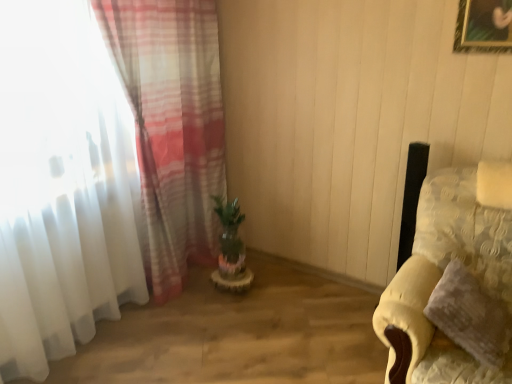
Question: Does green matte plant at center have a greater width compared to yellow fabric couch at right?

Choices:
 (A) yes
 (B) no

Answer: (B)

Question: Would you say yellow fabric couch at right is part of green matte plant at center's contents?

Choices:
 (A) no
 (B) yes

Answer: (A)

Question: From a real-world perspective, is green matte plant at center physically above yellow fabric couch at right?

Choices:
 (A) no
 (B) yes

Answer: (A)

Question: Is green matte plant at center at the right side of yellow fabric couch at right?

Choices:
 (A) yes
 (B) no

Answer: (B)

Question: Is the depth of green matte plant at center greater than that of yellow fabric couch at right?

Choices:
 (A) no
 (B) yes

Answer: (B)

Question: From a real-world perspective, is green matte plant at center above or below yellow fabric couch at right?

Choices:
 (A) above
 (B) below

Answer: (B)

Question: Considering the positions of point (234, 210) and point (495, 296), is point (234, 210) closer or farther from the camera than point (495, 296)?

Choices:
 (A) farther
 (B) closer

Answer: (A)

Question: From the image's perspective, relative to yellow fabric couch at right, is green matte plant at center above or below?

Choices:
 (A) below
 (B) above

Answer: (B)

Question: Relative to yellow fabric couch at right, is green matte plant at center in front or behind?

Choices:
 (A) behind
 (B) front

Answer: (A)

Question: Is translucent fabric curtain at left bigger or smaller than yellow fabric couch at right?

Choices:
 (A) big
 (B) small

Answer: (A)

Question: Considering the relative positions of translucent fabric curtain at left and yellow fabric couch at right in the image provided, is translucent fabric curtain at left to the left or to the right of yellow fabric couch at right?

Choices:
 (A) right
 (B) left

Answer: (B)

Question: Is point (70, 286) positioned closer to the camera than point (437, 357)?

Choices:
 (A) closer
 (B) farther

Answer: (B)

Question: In terms of width, does translucent fabric curtain at left look wider or thinner when compared to yellow fabric couch at right?

Choices:
 (A) thin
 (B) wide

Answer: (A)

Question: From the image's perspective, relative to green matte plant at center, is fluffy yellow pillow at right above or below?

Choices:
 (A) above
 (B) below

Answer: (B)

Question: Considering their positions, is fluffy yellow pillow at right located in front of or behind green matte plant at center?

Choices:
 (A) behind
 (B) front

Answer: (B)